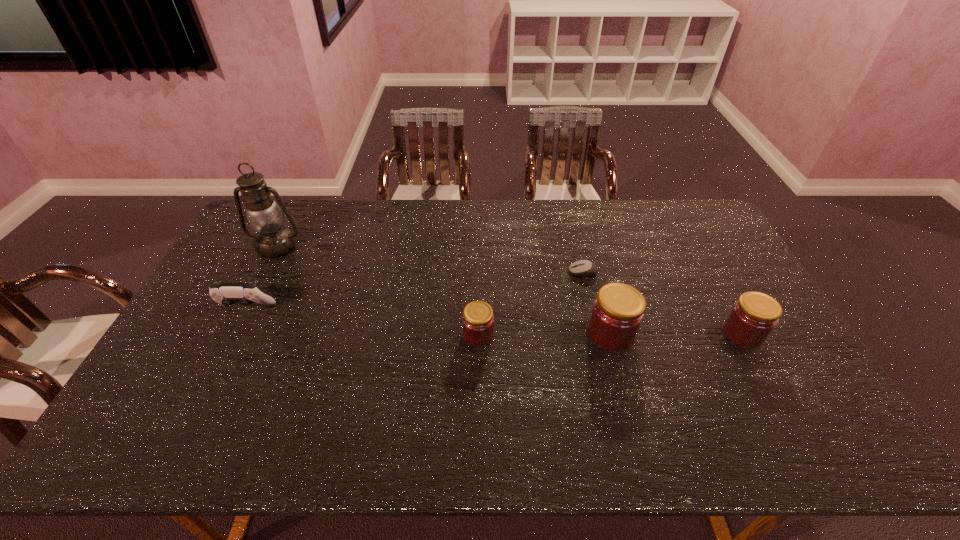
At what (x,y) coordinates should I click in order to perform the action: click on free area in between the rightmost jam and the tallest object. Please return your answer as a coordinate pair (x, y). The height and width of the screenshot is (540, 960). Looking at the image, I should click on (510, 290).

Locate an element on the screen. free space between the farthest object and the computer equipment is located at coordinates (430, 259).

You are a GUI agent. You are given a task and a screenshot of the screen. Output one action in this format:
    pyautogui.click(x=<x>, y=<y>)
    Task: Click on the vacant space that is in between the shortest object and the farthest object
    The image size is (960, 540).
    Given the screenshot: What is the action you would take?
    pos(430,259)

Locate an element on the screen. The height and width of the screenshot is (540, 960). empty space between the tallest jam and the shortest jam is located at coordinates (544, 335).

Where is `free spot between the tallest object and the third object from left to right`? The width and height of the screenshot is (960, 540). free spot between the tallest object and the third object from left to right is located at coordinates (377, 291).

Find the location of a particular element. The width and height of the screenshot is (960, 540). vacant space that's between the tallest object and the control is located at coordinates (262, 277).

The image size is (960, 540). I want to click on empty location between the leftmost jam and the tallest jam, so click(x=544, y=335).

The height and width of the screenshot is (540, 960). Identify the location of vacant space that's between the farthest object and the rightmost object. (510, 290).

Locate an element on the screen. The image size is (960, 540). free space between the control and the farthest object is located at coordinates (262, 277).

Locate an element on the screen. object that is the second nearest to the shortest jam is located at coordinates (583, 267).